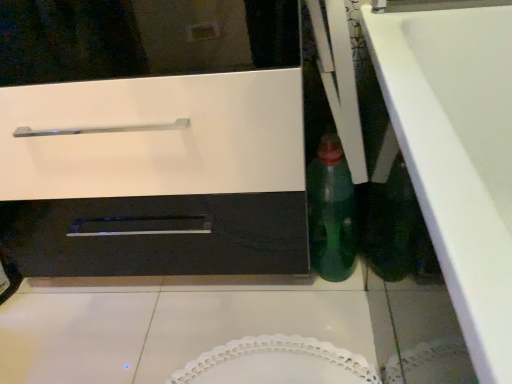
This screenshot has width=512, height=384. Describe the element at coordinates (331, 212) in the screenshot. I see `green glass bottle at center-right` at that location.

Locate an element on the screen. Image resolution: width=512 pixels, height=384 pixels. white glossy oven at center is located at coordinates (152, 137).

Which is more to the right, white glossy counter top at lower right or white glossy oven at center?

white glossy counter top at lower right is more to the right.

From the image's perspective, is white glossy counter top at lower right positioned above or below white glossy oven at center?

Clearly, from the image's perspective, white glossy counter top at lower right is below white glossy oven at center.

Considering the relative positions of white glossy counter top at lower right and white glossy oven at center in the image provided, is white glossy counter top at lower right behind white glossy oven at center?

No, white glossy counter top at lower right is in front of white glossy oven at center.

Is white glossy counter top at lower right far away from white glossy oven at center?

No.

Considering the relative positions of white glossy oven at center and white glossy counter top at lower right in the image provided, is white glossy oven at center behind white glossy counter top at lower right?

Yes.

Is point (192, 31) farther from viewer compared to point (507, 322)?

Yes, it is behind point (507, 322).

Could you tell me if white glossy oven at center is facing white glossy counter top at lower right?

No, white glossy oven at center is not aimed at white glossy counter top at lower right.

Considering the relative positions of white glossy oven at center and white glossy counter top at lower right in the image provided, is white glossy oven at center to the left of white glossy counter top at lower right from the viewer's perspective?

Correct, you'll find white glossy oven at center to the left of white glossy counter top at lower right.

Based on the photo, does white glossy oven at center appear on the left side of green glass bottle at center-right?

Yes.

Is white glossy oven at center in front of green glass bottle at center-right?

Yes, it is.

Is white glossy oven at center looking in the opposite direction of green glass bottle at center-right?

white glossy oven at center is not turned away from green glass bottle at center-right.

Consider the image. From the image's perspective, is white glossy oven at center located above or below green glass bottle at center-right?

Based on their image positions, white glossy oven at center is located above green glass bottle at center-right.

This screenshot has width=512, height=384. What are the coordinates of `bottle to the right of white glossy oven at center` in the screenshot? It's located at (331, 212).

From the picture: From the image's perspective, does green glass bottle at center-right appear higher than white glossy oven at center?

Actually, green glass bottle at center-right appears below white glossy oven at center in the image.

Which of these two, green glass bottle at center-right or white glossy oven at center, is smaller?

Smaller between the two is green glass bottle at center-right.

Does green glass bottle at center-right lie behind white glossy oven at center?

Yes, it is.

Who is bigger, green glass bottle at center-right or white glossy counter top at lower right?

white glossy counter top at lower right.

Identify the location of counter top below the green glass bottle at center-right (from the image's perspective). This screenshot has height=384, width=512. (458, 156).

Would you say green glass bottle at center-right contains white glossy counter top at lower right?

No, white glossy counter top at lower right is not a part of green glass bottle at center-right.

From the image's perspective, is green glass bottle at center-right positioned above or below white glossy counter top at lower right?

green glass bottle at center-right is above white glossy counter top at lower right.

From a real-world perspective, is white glossy counter top at lower right positioned above or below green glass bottle at center-right?

From a real-world perspective, white glossy counter top at lower right is physically above green glass bottle at center-right.

Is green glass bottle at center-right inside white glossy counter top at lower right?

No, green glass bottle at center-right is not inside white glossy counter top at lower right.

Can you confirm if white glossy counter top at lower right is smaller than green glass bottle at center-right?

Actually, white glossy counter top at lower right might be larger than green glass bottle at center-right.

I want to click on counter top on the right of green glass bottle at center-right, so click(x=458, y=156).

Find the location of a particular element. The height and width of the screenshot is (384, 512). oven behind the white glossy counter top at lower right is located at coordinates (152, 137).

In the image, there is a white glossy oven at center. At what (x,y) coordinates should I click in order to perform the action: click on counter top below it (from the image's perspective). Please return your answer as a coordinate pair (x, y). Looking at the image, I should click on [458, 156].

Looking at the image, which one is located further to white glossy oven at center, white glossy counter top at lower right or green glass bottle at center-right?

white glossy counter top at lower right lies further to white glossy oven at center than the other object.

Estimate the real-world distances between objects in this image. Which object is further from white glossy oven at center, green glass bottle at center-right or white glossy counter top at lower right?

white glossy counter top at lower right is further to white glossy oven at center.

When comparing their distances from green glass bottle at center-right, does white glossy oven at center or white glossy counter top at lower right seem further?

white glossy counter top at lower right is positioned further to the anchor green glass bottle at center-right.

Considering their positions, is green glass bottle at center-right positioned closer to white glossy counter top at lower right than white glossy oven at center?

Based on the image, green glass bottle at center-right appears to be nearer to white glossy counter top at lower right.

Based on their spatial positions, is white glossy counter top at lower right or white glossy oven at center closer to green glass bottle at center-right?

The object closer to green glass bottle at center-right is white glossy oven at center.

Consider the image. Considering their positions, is white glossy oven at center positioned further to white glossy counter top at lower right than green glass bottle at center-right?

white glossy oven at center is further to white glossy counter top at lower right.

Find the location of a particular element. The height and width of the screenshot is (384, 512). bottle between white glossy oven at center and white glossy counter top at lower right is located at coordinates pos(331,212).